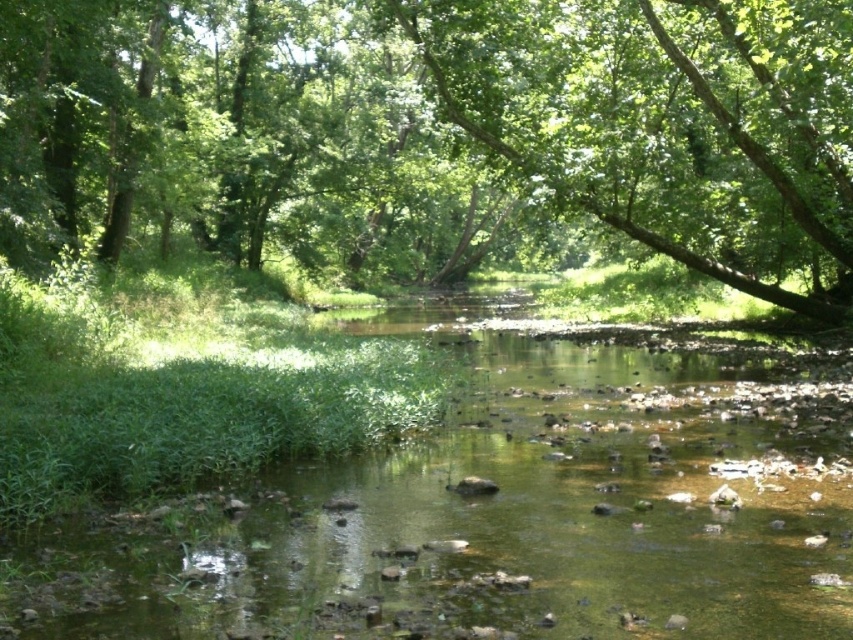
Is green leafy tree at center positioned before clear water at center?

No, it is behind clear water at center.

This screenshot has height=640, width=853. In order to click on green leafy tree at center in this screenshot , I will do click(436, 129).

Identify the location of green leafy tree at center. This screenshot has height=640, width=853. (436, 129).